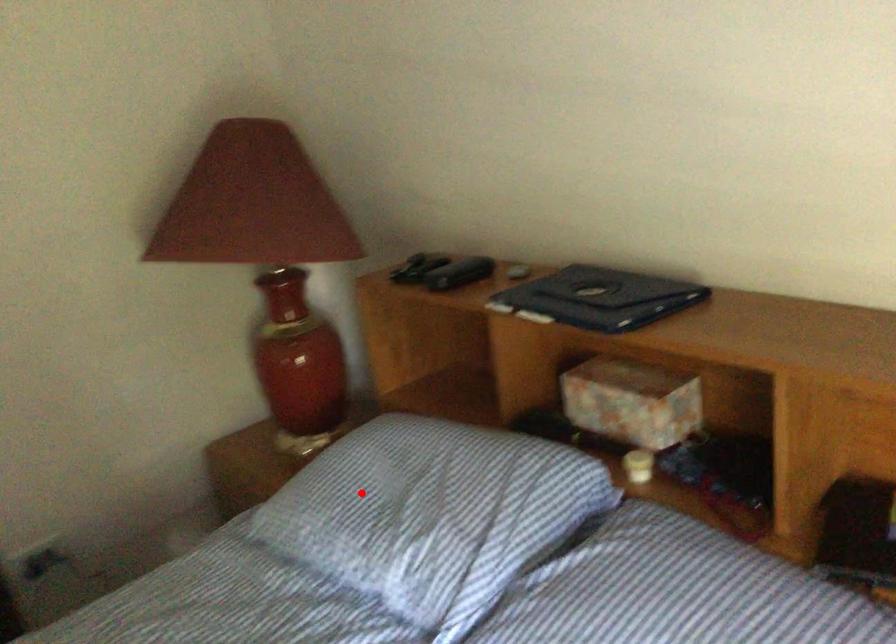
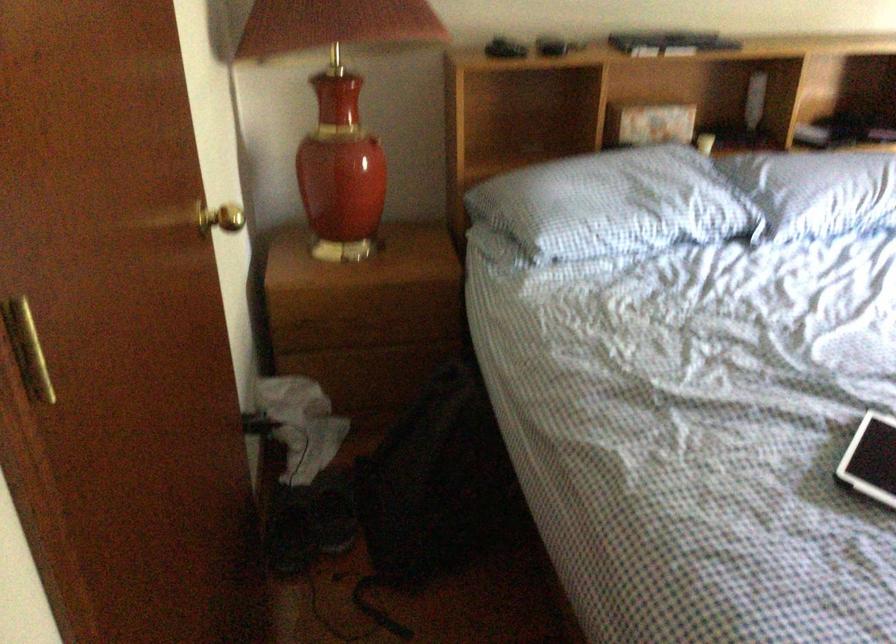
The point at the highlighted location is marked in the first image. Where is the corresponding point in the second image?

(613, 204)